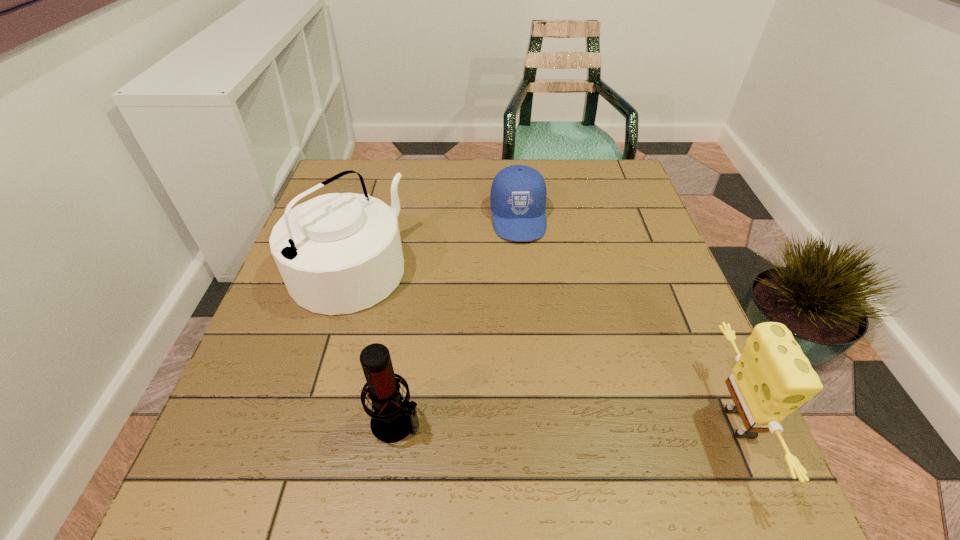
This screenshot has width=960, height=540. I want to click on vacant space located 0.230m on the front-facing side of the cap, so click(x=532, y=315).

I want to click on free space located 0.060m on the front-facing side of the cap, so click(524, 261).

The image size is (960, 540). I want to click on object that is positioned at the far edge, so 518,194.

The image size is (960, 540). In order to click on microphone situated at the near edge in this screenshot , I will do `click(392, 420)`.

Locate an element on the screen. Image resolution: width=960 pixels, height=540 pixels. sponge that is at the near edge is located at coordinates (772, 378).

At what (x,y) coordinates should I click in order to perform the action: click on object at the left edge. Please return your answer as a coordinate pair (x, y). The height and width of the screenshot is (540, 960). Looking at the image, I should click on (339, 253).

At what (x,y) coordinates should I click in order to perform the action: click on object that is positioned at the right edge. Please return your answer as a coordinate pair (x, y). This screenshot has width=960, height=540. Looking at the image, I should click on (772, 378).

The image size is (960, 540). Identify the location of object positioned at the near right corner. (772, 378).

In the image, there is a desktop. Where is `vacant region at the far edge`? This screenshot has height=540, width=960. vacant region at the far edge is located at coordinates (471, 166).

In order to click on vacant space at the near edge of the desktop in this screenshot , I will do `click(576, 411)`.